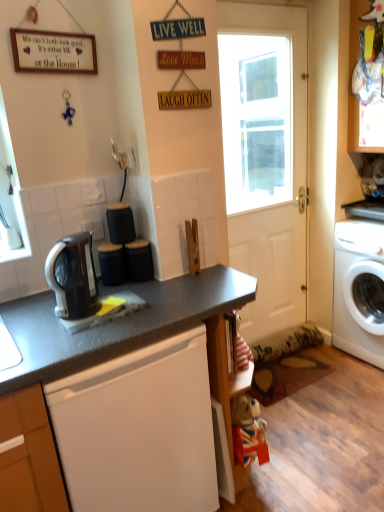
The width and height of the screenshot is (384, 512). I want to click on free space in front of matte black coffee maker at center, the 1th appliance positioned from the left, so tap(119, 295).